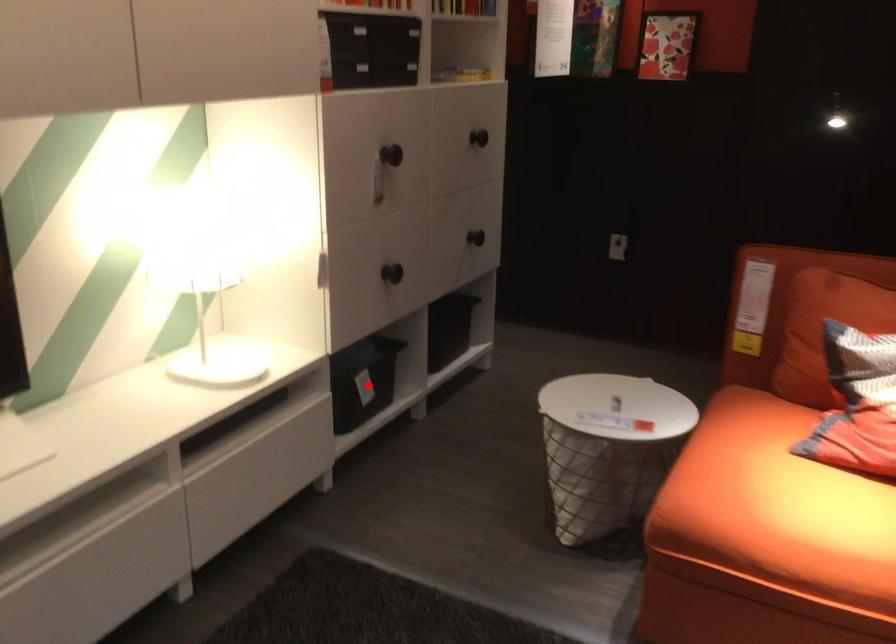
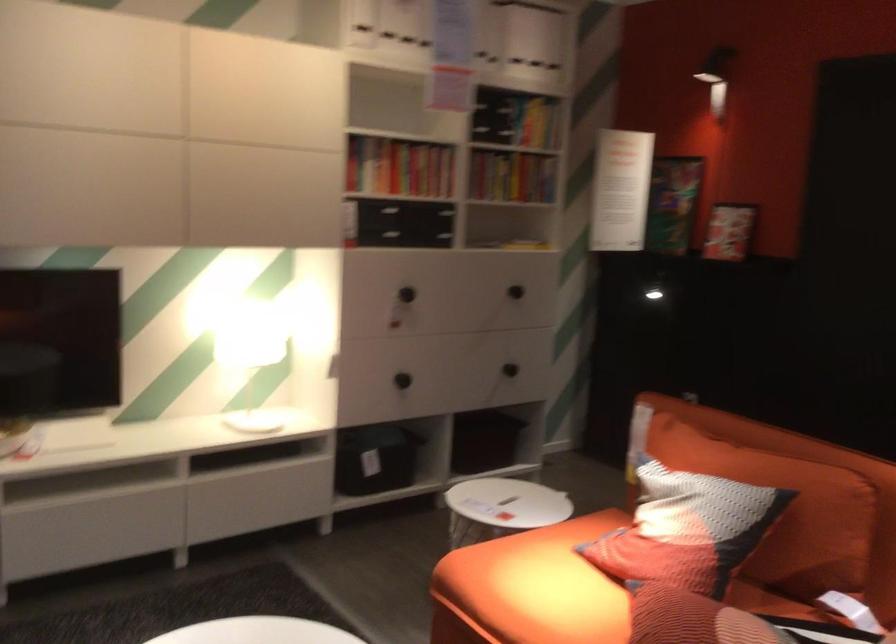
Find the pixel in the second image that matches the highlighted location in the first image.

(375, 459)